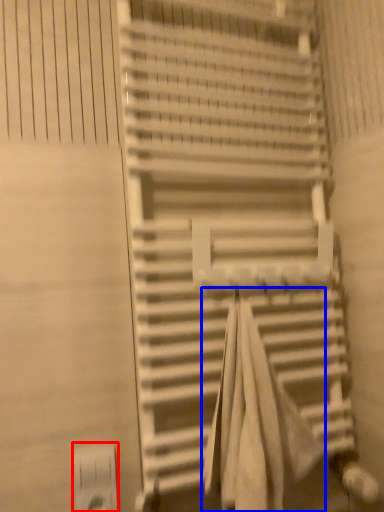
Question: Which object is closer to the camera taking this photo, electric outlet (highlighted by a red box) or beach towel (highlighted by a blue box)?

Choices:
 (A) electric outlet
 (B) beach towel

Answer: (B)